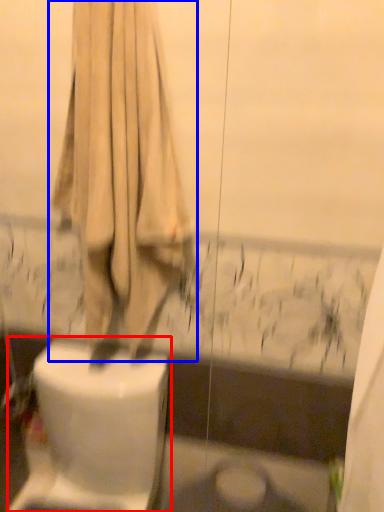
Question: Which object appears farthest to the camera in this image, toilet (highlighted by a red box) or curtain (highlighted by a blue box)?

Choices:
 (A) toilet
 (B) curtain

Answer: (A)